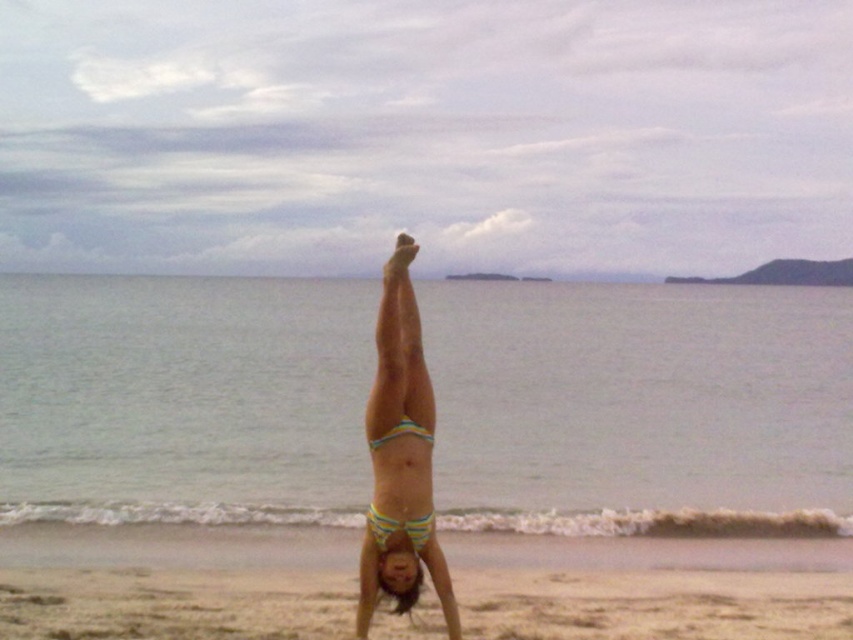
In the scene shown: Between beige sandy beach at lower center and yellow striped bikini at center, which one is positioned lower?

beige sandy beach at lower center is below.

Is beige sandy beach at lower center bigger than yellow striped bikini at center?

Indeed, beige sandy beach at lower center has a larger size compared to yellow striped bikini at center.

This screenshot has width=853, height=640. I want to click on beige sandy beach at lower center, so click(656, 605).

Where is `beige sandy beach at lower center`? This screenshot has width=853, height=640. beige sandy beach at lower center is located at coordinates (656, 605).

Consider the image. Between striped bikini at center and striped fabric bikini at center, which one appears on the right side from the viewer's perspective?

From the viewer's perspective, striped fabric bikini at center appears more on the right side.

Locate an element on the screen. striped bikini at center is located at coordinates tap(399, 460).

The height and width of the screenshot is (640, 853). Identify the location of striped bikini at center. (399, 460).

Is point (86, 602) closer to viewer compared to point (393, 401)?

No, it is not.

The height and width of the screenshot is (640, 853). Identify the location of beige sandy beach at lower center. (656, 605).